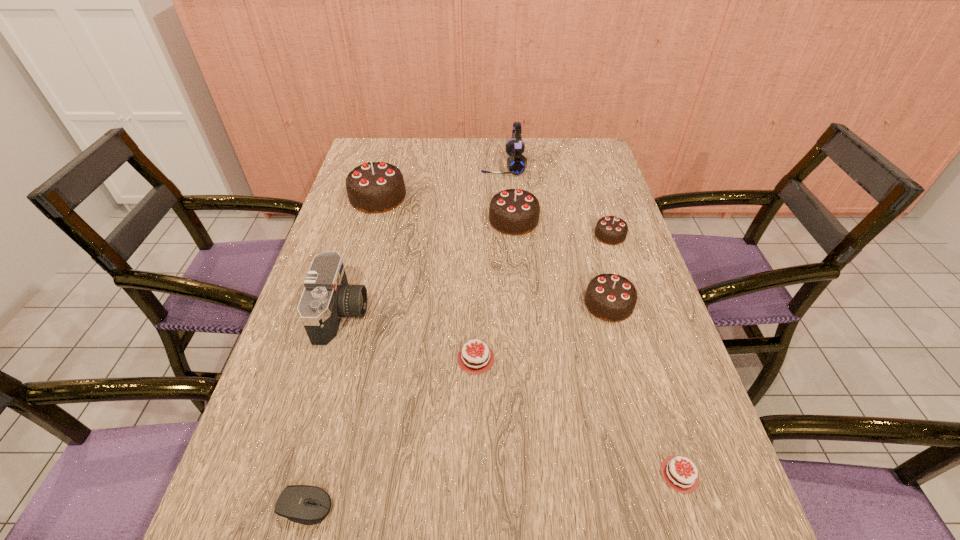
In the image, there is a desktop. Where is `vacant space at the far edge`? Image resolution: width=960 pixels, height=540 pixels. vacant space at the far edge is located at coordinates (478, 160).

Find the location of a particular element. The width and height of the screenshot is (960, 540). vacant area at the left edge of the desktop is located at coordinates (239, 474).

At what (x,y) coordinates should I click in order to perform the action: click on vacant space at the right edge of the desktop. Please return your answer as a coordinate pair (x, y). The width and height of the screenshot is (960, 540). Looking at the image, I should click on (635, 271).

At what (x,y) coordinates should I click in order to perform the action: click on vacant space at the far right corner of the desktop. Please return your answer as a coordinate pair (x, y). This screenshot has width=960, height=540. Looking at the image, I should click on (578, 163).

Locate an element on the screen. The height and width of the screenshot is (540, 960). vacant space in between the second farthest red chocolate cake and the camera is located at coordinates (511, 394).

Locate an element on the screen. Image resolution: width=960 pixels, height=540 pixels. free space between the second smallest red chocolate cake and the computer equipment is located at coordinates (492, 490).

Find the location of `free space between the biggest red chocolate cake and the black computer equipment`. free space between the biggest red chocolate cake and the black computer equipment is located at coordinates (391, 432).

This screenshot has width=960, height=540. Identify the location of empty space that is in between the fourth farthest chocolate cake and the camera. (475, 309).

This screenshot has height=540, width=960. I want to click on empty space that is in between the fifth tallest object and the black camera, so 475,309.

Identify the location of empty space that is in between the second biggest red chocolate cake and the second tallest chocolate cake. The height and width of the screenshot is (540, 960). (596, 347).